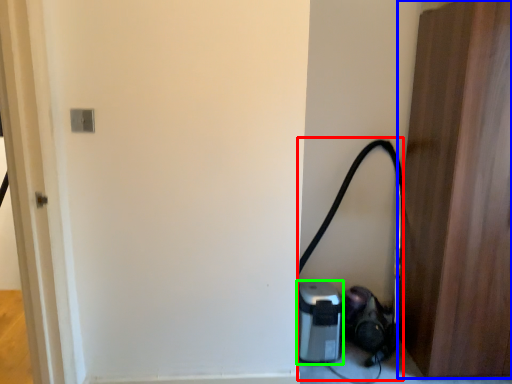
Question: Estimate the real-world distances between objects in this image. Which object is farther from garden hose (highlighted by a red box), door (highlighted by a blue box) or appliance (highlighted by a green box)?

Choices:
 (A) door
 (B) appliance

Answer: (A)